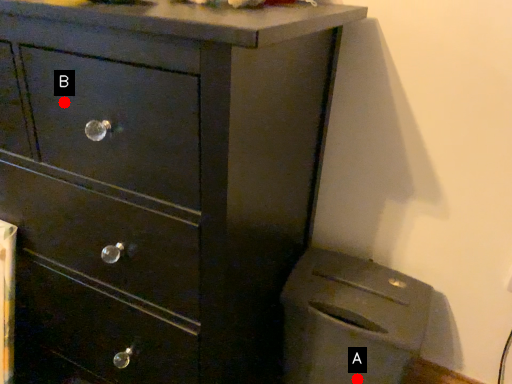
Question: Two points are circled on the image, labeled by A and B beside each circle. Which point is farther to the camera?

Choices:
 (A) A is further
 (B) B is further

Answer: (A)